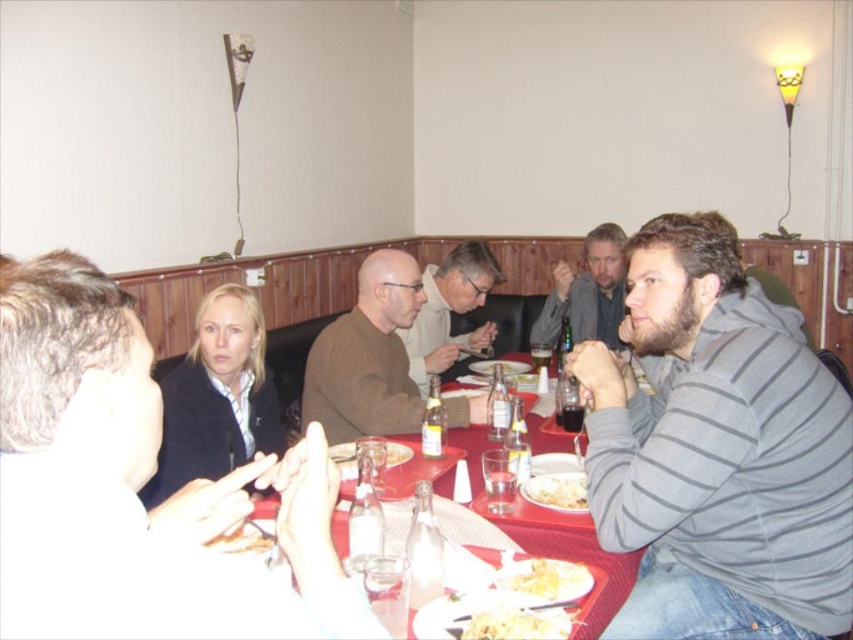
Does white fluffy pasta at center appear on the right side of golden crispy bread at center?

Yes, white fluffy pasta at center is to the right of golden crispy bread at center.

Is point (554, 472) positioned in front of point (254, 550)?

No, (554, 472) is further to viewer.

This screenshot has height=640, width=853. In order to click on white fluffy pasta at center in this screenshot , I will do `click(556, 492)`.

Identify the location of white fluffy pasta at center. This screenshot has width=853, height=640. (556, 492).

Can you confirm if red plastic tray at center is smaller than yellowish matte pasta at center?

No, red plastic tray at center is not smaller than yellowish matte pasta at center.

Which is in front, point (403, 442) or point (544, 632)?

Point (544, 632)

Which is behind, point (404, 481) or point (498, 627)?

Positioned behind is point (404, 481).

Where is `red plastic tray at center`? This screenshot has width=853, height=640. red plastic tray at center is located at coordinates (529, 525).

Can you confirm if brown wool sweater at upper left is taller than yellowish matte pasta at lower center?

Correct, brown wool sweater at upper left is much taller as yellowish matte pasta at lower center.

Is brown wool sweater at upper left behind yellowish matte pasta at lower center?

That is False.

Is point (196, 588) closer to viewer compared to point (564, 595)?

Yes, it is in front of point (564, 595).

The height and width of the screenshot is (640, 853). What are the coordinates of `brown wool sweater at upper left` in the screenshot? It's located at (136, 486).